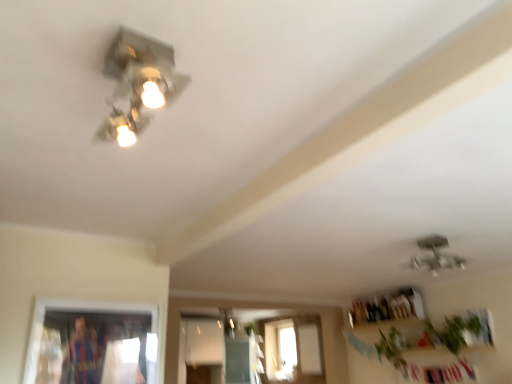
Question: Is matte silver lamp at center, marked as the 3th lamp in a top-to-bottom arrangement, taller than green leafy plant at lower right, the second plant viewed from the right?

Choices:
 (A) no
 (B) yes

Answer: (A)

Question: Considering the relative sizes of matte silver lamp at center, which is counted as the third lamp, starting from the right, and green leafy plant at lower right, the second plant when ordered from front to back, in the image provided, is matte silver lamp at center, which is counted as the third lamp, starting from the right, shorter than green leafy plant at lower right, the second plant when ordered from front to back,?

Choices:
 (A) yes
 (B) no

Answer: (A)

Question: Is matte silver lamp at center, marked as the 3th lamp in a top-to-bottom arrangement, outside of green leafy plant at lower right, the second plant viewed from the right?

Choices:
 (A) yes
 (B) no

Answer: (A)

Question: Does matte silver lamp at center, arranged as the first lamp when viewed from the left, turn towards green leafy plant at lower right, the second plant viewed from the right?

Choices:
 (A) no
 (B) yes

Answer: (B)

Question: Does matte silver lamp at center, marked as the 3th lamp in a top-to-bottom arrangement, have a greater width compared to green leafy plant at lower right, the second plant viewed from the right?

Choices:
 (A) no
 (B) yes

Answer: (B)

Question: From the image's perspective, does matte silver lamp at center, the 1th lamp positioned from the back, appear higher than green leafy plant at lower right, the 1th plant from the back?

Choices:
 (A) yes
 (B) no

Answer: (B)

Question: Is green leafy plant at lower right, placed as the first plant when sorted from right to left, to the left of green leafy plant at lower right, the second plant viewed from the right, from the viewer's perspective?

Choices:
 (A) no
 (B) yes

Answer: (A)

Question: From a real-world perspective, is green leafy plant at lower right, placed as the first plant when sorted from right to left, located beneath green leafy plant at lower right, the 1th plant from the back?

Choices:
 (A) yes
 (B) no

Answer: (B)

Question: Can you confirm if green leafy plant at lower right, acting as the first plant starting from the front, is taller than green leafy plant at lower right, marked as the 1th plant in a left-to-right arrangement?

Choices:
 (A) no
 (B) yes

Answer: (A)

Question: Considering the relative sizes of green leafy plant at lower right, acting as the first plant starting from the front, and green leafy plant at lower right, the second plant when ordered from front to back, in the image provided, is green leafy plant at lower right, acting as the first plant starting from the front, thinner than green leafy plant at lower right, the second plant when ordered from front to back,?

Choices:
 (A) yes
 (B) no

Answer: (A)

Question: Is green leafy plant at lower right, acting as the 2th plant starting from the back, closer to the viewer compared to green leafy plant at lower right, the second plant when ordered from front to back?

Choices:
 (A) yes
 (B) no

Answer: (A)

Question: Is green leafy plant at lower right, the second plant when ordered from front to back, inside green leafy plant at lower right, acting as the 2th plant starting from the back?

Choices:
 (A) yes
 (B) no

Answer: (B)

Question: Can you confirm if matte silver lamp at center, which is counted as the third lamp, starting from the right, is taller than metallic silver light fixture at upper left, the third lamp when ordered from back to front?

Choices:
 (A) yes
 (B) no

Answer: (A)